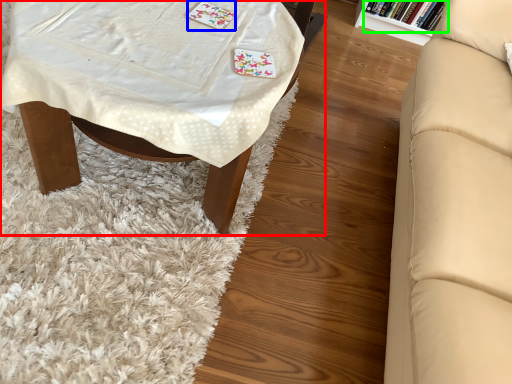
Question: Which object is the closest to the table (highlighted by a red box)? Choose among these: card game (highlighted by a blue box) or book (highlighted by a green box).

Choices:
 (A) card game
 (B) book

Answer: (A)